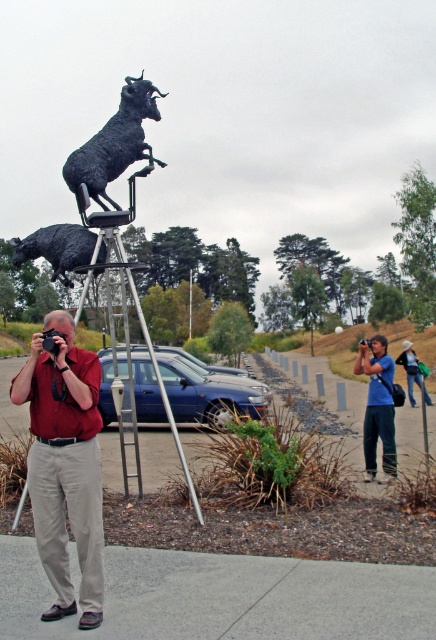
Does bronze statue at center appear under blue cotton shirt at center?

Actually, bronze statue at center is above blue cotton shirt at center.

Is bronze statue at center behind blue cotton shirt at center?

No, bronze statue at center is in front of blue cotton shirt at center.

Find the location of a particular element. The height and width of the screenshot is (640, 436). bronze statue at center is located at coordinates (115, 147).

Who is shorter, bronze statue at center or black matte bull at center?

black matte bull at center

Who is higher up, bronze statue at center or black matte bull at center?

bronze statue at center

Locate an element on the screen. The height and width of the screenshot is (640, 436). bronze statue at center is located at coordinates (115, 147).

The image size is (436, 640). Identify the location of bronze statue at center. (115, 147).

Measure the distance between khaki pants at center and blue cotton shirt at center.

khaki pants at center is 4.48 meters from blue cotton shirt at center.

Between point (79, 349) and point (389, 436), which one is positioned behind?

Point (389, 436)

Does point (38, 385) come in front of point (378, 349)?

Yes.

Where is `khaki pants at center`? The image size is (436, 640). khaki pants at center is located at coordinates (64, 465).